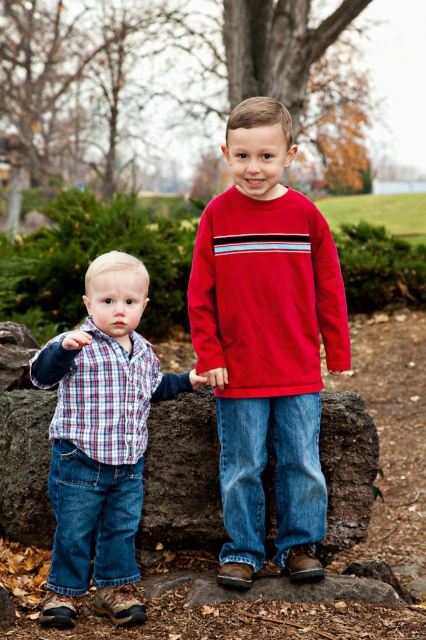
Question: Can you confirm if matte red long-sleeve shirt at center is positioned below plaid shirt at left?

Choices:
 (A) yes
 (B) no

Answer: (B)

Question: Which is farther from the matte red long-sleeve shirt at center?

Choices:
 (A) plaid shirt at left
 (B) red fleece sweatshirt at center

Answer: (A)

Question: Which of the following is the closest to the observer?

Choices:
 (A) (230, 285)
 (B) (108, 276)
 (C) (230, 307)

Answer: (B)

Question: Does matte red long-sleeve shirt at center have a greater width compared to red fleece sweatshirt at center?

Choices:
 (A) yes
 (B) no

Answer: (B)

Question: Estimate the real-world distances between objects in this image. Which object is farther from the plaid shirt at left?

Choices:
 (A) red fleece sweatshirt at center
 (B) matte red long-sleeve shirt at center

Answer: (A)

Question: Can you confirm if plaid shirt at left is positioned to the left of red fleece sweatshirt at center?

Choices:
 (A) no
 (B) yes

Answer: (B)